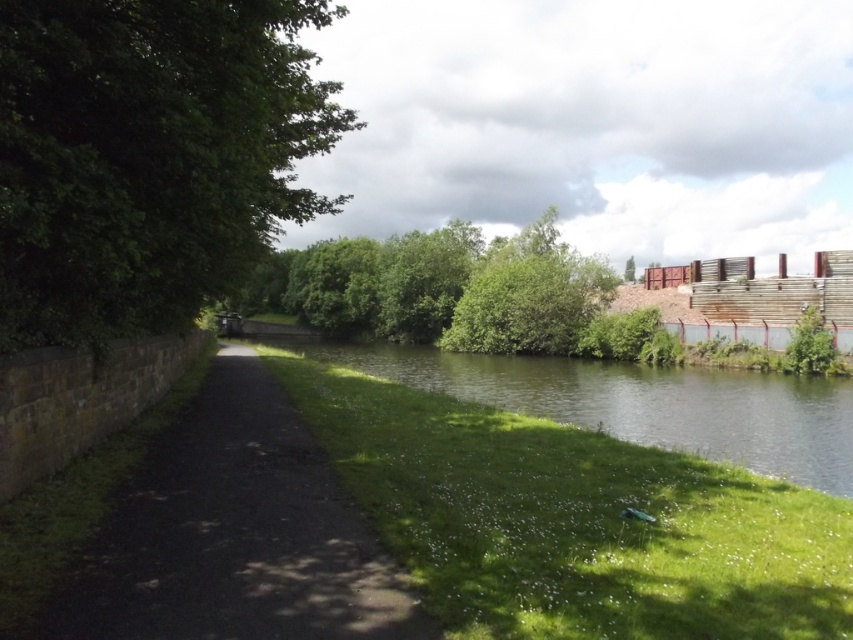
Is dark asphalt path at center taller than green grassy bank at lower center?

No, dark asphalt path at center is not taller than green grassy bank at lower center.

Where is `dark asphalt path at center`? The height and width of the screenshot is (640, 853). dark asphalt path at center is located at coordinates (235, 534).

Is point (310, 449) farther from viewer compared to point (412, 364)?

No, it is in front of (412, 364).

Identify the location of dark asphalt path at center. This screenshot has height=640, width=853. (235, 534).

Who is higher up, green leafy tree at center or green leafy tree at upper right?

green leafy tree at upper right is higher up.

Is point (271, 282) less distant than point (628, 259)?

Yes, point (271, 282) is in front of point (628, 259).

The width and height of the screenshot is (853, 640). What do you see at coordinates (440, 289) in the screenshot? I see `green leafy tree at center` at bounding box center [440, 289].

Locate an element on the screen. This screenshot has height=640, width=853. green leafy tree at center is located at coordinates (x=440, y=289).

Between point (93, 269) and point (527, 372), which one is positioned in front?

Point (93, 269)

Is green leafy tree at left to the left of green grassy bank at lower center from the viewer's perspective?

Yes, green leafy tree at left is to the left of green grassy bank at lower center.

Is point (13, 260) more distant than point (840, 465)?

No, it is not.

Locate an element on the screen. green leafy tree at left is located at coordinates (149, 156).